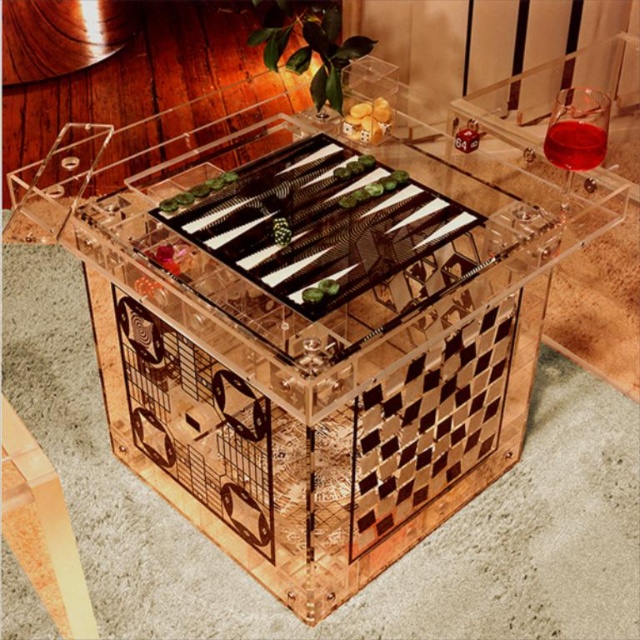
You are standing at the edge of the backgammon board and see two points marked as point 1 and point 2. Point 1 is at coordinate point (580, 128) and point 2 is at coordinate point (346, 115). If you want to move a piece from point 1 to point 2, in which direction should you move it?

To move the piece from point 1 at coordinate point (580, 128) to point 2 at coordinate point (346, 115), you should move it backward since point 1 is in front of point 2.

You are a game organizer who needs to place a new glass of water at the exact location where the transparent liquid at upper right is currently located. According to the image, what are the coordinates of the spot where you should place the new glass?

The coordinates for the transparent liquid at upper right are at point (x=573, y=145), so you should place the new glass at those coordinates.

You are a game player who wants to reach for the transparent glass wine at upper right and the translucent plastic dice at center. Which object is located lower in the image?

The transparent glass wine at upper right is located below the translucent plastic dice at center, so it is lower in the image.